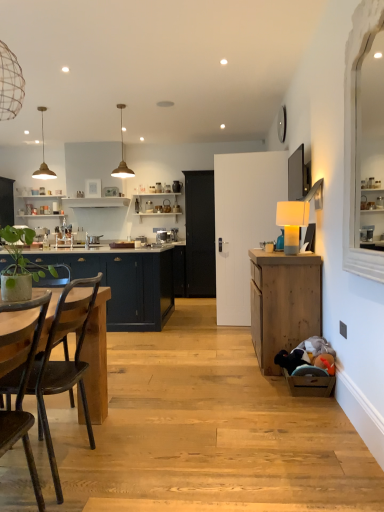
The width and height of the screenshot is (384, 512). What do you see at coordinates (283, 303) in the screenshot?
I see `wooden cabinet at right, which is the first cabinetry from right to left` at bounding box center [283, 303].

Where is `satin silver toaster at center`? This screenshot has height=512, width=384. satin silver toaster at center is located at coordinates (165, 236).

The height and width of the screenshot is (512, 384). What are the coordinates of `rustic wood chair at left` in the screenshot? It's located at (64, 361).

What do you see at coordinates (292, 222) in the screenshot? Image resolution: width=384 pixels, height=512 pixels. I see `white matte lamp at right, arranged as the first lamp when viewed from the front` at bounding box center [292, 222].

Measure the distance between point [39,174] and camera.

Point [39,174] is 22.80 feet away from camera.

Identify the location of wooden cabinet at right, marked as the second cabinetry in a left-to-right arrangement. (283, 303).

Which object is thinner, black matte door at center or matte gold pendant light at upper center, the first lamp positioned from the back?

matte gold pendant light at upper center, the first lamp positioned from the back, is thinner.

How different are the orientations of black matte door at center and matte gold pendant light at upper center, the first lamp positioned from the back, in degrees?

The angle between the facing direction of black matte door at center and the facing direction of matte gold pendant light at upper center, the first lamp positioned from the back, is 3.25 degrees.

Is black matte door at center situated inside matte gold pendant light at upper center, positioned as the third lamp in right-to-left order, or outside?

black matte door at center is not inside matte gold pendant light at upper center, positioned as the third lamp in right-to-left order, it's outside.

Between black matte door at center and matte gold pendant light at upper center, which is the 2th lamp from bottom to top, which one appears on the right side from the viewer's perspective?

black matte door at center.

Is matte gold pendant light at upper center, marked as the 3th lamp in a bottom-to-top arrangement, further to camera compared to black matte door at center?

No, matte gold pendant light at upper center, marked as the 3th lamp in a bottom-to-top arrangement, is closer to the viewer.

In the scene shown: Is matte gold pendant light at upper center, which is counted as the 1th lamp, starting from the top, not close to black matte door at center?

That's right, there is a large distance between matte gold pendant light at upper center, which is counted as the 1th lamp, starting from the top, and black matte door at center.

From a real-world perspective, which is physically above, matte gold pendant light at upper center, marked as the 3th lamp in a bottom-to-top arrangement, or black matte door at center?

From a 3D spatial view, matte gold pendant light at upper center, marked as the 3th lamp in a bottom-to-top arrangement, is above.

Is matte gold pendant light at upper center, arranged as the second lamp when viewed from the front, aimed at black matte door at center?

No, matte gold pendant light at upper center, arranged as the second lamp when viewed from the front, is not turned towards black matte door at center.

Is matte dark blue cabinets at left, which ranks as the first cabinetry in left-to-right order, surrounded by black matte door at center?

No, matte dark blue cabinets at left, which ranks as the first cabinetry in left-to-right order, is not a part of black matte door at center.

Where is `glass door that is above the matte dark blue cabinets at left, acting as the first cabinetry starting from the back (from the image's perspective)`? Image resolution: width=384 pixels, height=512 pixels. glass door that is above the matte dark blue cabinets at left, acting as the first cabinetry starting from the back (from the image's perspective) is located at coordinates (200, 234).

From a real-world perspective, does black matte door at center stand above matte dark blue cabinets at left, the second cabinetry in the right-to-left sequence?

Yes.

Can you confirm if white matte lamp at right, acting as the first lamp starting from the bottom, is shorter than wooden cabinet at right, arranged as the second cabinetry when viewed from the back?

Yes, white matte lamp at right, acting as the first lamp starting from the bottom, is shorter than wooden cabinet at right, arranged as the second cabinetry when viewed from the back.

From a real-world perspective, who is located higher, white matte lamp at right, which is the third lamp from left to right, or wooden cabinet at right, marked as the second cabinetry in a left-to-right arrangement?

white matte lamp at right, which is the third lamp from left to right.

How many degrees apart are the facing directions of rustic wood chair at left and matte gold pendant light at upper center, the 2th lamp when ordered from left to right?

92 degrees.

Can you confirm if rustic wood chair at left is bigger than matte gold pendant light at upper center, which is counted as the 1th lamp, starting from the top?

Correct, rustic wood chair at left is larger in size than matte gold pendant light at upper center, which is counted as the 1th lamp, starting from the top.

Is matte gold pendant light at upper center, arranged as the second lamp when viewed from the front, a part of rustic wood chair at left?

Definitely not — matte gold pendant light at upper center, arranged as the second lamp when viewed from the front, is not inside rustic wood chair at left.

Considering the sizes of objects rustic wood chair at left and matte gold pendant light at upper center, which is the second lamp in right-to-left order, in the image provided, who is wider, rustic wood chair at left or matte gold pendant light at upper center, which is the second lamp in right-to-left order,?

rustic wood chair at left.

At what (x,y) coordinates should I click in order to perform the action: click on lamp that is the 3rd object located in front of the black matte door at center. Please return your answer as a coordinate pair (x, y). Looking at the image, I should click on click(292, 222).

Is point (188, 242) positioned after point (294, 229)?

Yes, it is behind point (294, 229).

Can white matte lamp at right, arranged as the first lamp when viewed from the front, be found inside black matte door at center?

Definitely not — white matte lamp at right, arranged as the first lamp when viewed from the front, is not inside black matte door at center.

In the image, is black matte door at center positioned in front of or behind white matte lamp at right, arranged as the first lamp when viewed from the front?

In the image, black matte door at center appears behind white matte lamp at right, arranged as the first lamp when viewed from the front.

Is wooden cabinet at right, which is the first cabinetry from right to left, facing towards matte dark blue cabinets at left, acting as the first cabinetry starting from the back?

Yes.

From a real-world perspective, is wooden cabinet at right, arranged as the second cabinetry when viewed from the back, over matte dark blue cabinets at left, acting as the first cabinetry starting from the back?

No.

Does wooden cabinet at right, marked as the second cabinetry in a left-to-right arrangement, appear on the right side of matte dark blue cabinets at left, which is the 2th cabinetry from front to back?

Yes, wooden cabinet at right, marked as the second cabinetry in a left-to-right arrangement, is to the right of matte dark blue cabinets at left, which is the 2th cabinetry from front to back.

Can you confirm if wooden cabinet at right, arranged as the second cabinetry when viewed from the back, is smaller than matte dark blue cabinets at left, which ranks as the first cabinetry in left-to-right order?

Indeed, wooden cabinet at right, arranged as the second cabinetry when viewed from the back, has a smaller size compared to matte dark blue cabinets at left, which ranks as the first cabinetry in left-to-right order.

Locate an element on the screen. the 1st lamp in front of the black matte door at center, starting your count from the anchor is located at coordinates (43, 158).

Where is `glass door behind the matte gold pendant light at upper center, which is the second lamp in right-to-left order`? glass door behind the matte gold pendant light at upper center, which is the second lamp in right-to-left order is located at coordinates (200, 234).

Considering their positions, is satin silver toaster at center positioned further to wooden cabinet at right, which is the first cabinetry from right to left, than rustic wood chair at left?

Among the two, satin silver toaster at center is located further to wooden cabinet at right, which is the first cabinetry from right to left.

Estimate the real-world distances between objects in this image. Which object is further from rustic wood chair at left, satin silver toaster at center or matte gold pendant light at upper center, which is counted as the 1th lamp, starting from the top?

matte gold pendant light at upper center, which is counted as the 1th lamp, starting from the top, is positioned further to the anchor rustic wood chair at left.

Based on their spatial positions, is matte gold pendant light at upper center, which is the second lamp in right-to-left order, or black matte door at center closer to satin silver toaster at center?

black matte door at center is positioned closer to the anchor satin silver toaster at center.

Which object lies further to the anchor point matte dark blue cabinets at left, which ranks as the first cabinetry in left-to-right order, matte gold pendant light at upper center, which is counted as the 1th lamp, starting from the top, or rustic wood chair at left?

matte gold pendant light at upper center, which is counted as the 1th lamp, starting from the top, lies further to matte dark blue cabinets at left, which ranks as the first cabinetry in left-to-right order, than the other object.

Based on their spatial positions, is white matte lamp at right, acting as the first lamp starting from the bottom, or matte gold pendant light at upper center, the 2th lamp when ordered from left to right, closer to wooden cabinet at right, the 1th cabinetry from the front?

white matte lamp at right, acting as the first lamp starting from the bottom.

From the image, which object appears to be farther from green matte plant at left, white matte lamp at right, acting as the first lamp starting from the bottom, or wooden cabinet at right, the 1th cabinetry from the front?

The object further to green matte plant at left is white matte lamp at right, acting as the first lamp starting from the bottom.

When comparing their distances from satin silver toaster at center, does black matte door at center or white matte lamp at right, marked as the third lamp in a back-to-front arrangement, seem closer?

The object closer to satin silver toaster at center is black matte door at center.

Looking at the image, which one is located closer to wooden cabinet at right, marked as the second cabinetry in a left-to-right arrangement, green matte plant at left or black matte door at center?

green matte plant at left.

This screenshot has width=384, height=512. Find the location of `chair between green matte plant at left and white matte lamp at right, placed as the 3th lamp when sorted from top to bottom, from left to right`. chair between green matte plant at left and white matte lamp at right, placed as the 3th lamp when sorted from top to bottom, from left to right is located at coordinates (64, 361).

Find the location of `lamp between wooden cabinet at right, marked as the second cabinetry in a left-to-right arrangement, and matte gold pendant light at upper center, acting as the 2th lamp starting from the back, from front to back`. lamp between wooden cabinet at right, marked as the second cabinetry in a left-to-right arrangement, and matte gold pendant light at upper center, acting as the 2th lamp starting from the back, from front to back is located at coordinates (292, 222).

The width and height of the screenshot is (384, 512). In order to click on lamp located between matte gold pendant light at upper center, which is the 2th lamp from bottom to top, and black matte door at center in the left-right direction in this screenshot , I will do `click(122, 156)`.

Locate an element on the screen. This screenshot has height=512, width=384. plant located between rustic wood chair at left and matte gold pendant light at upper center, which is the 2th lamp from bottom to top, in the depth direction is located at coordinates (21, 256).